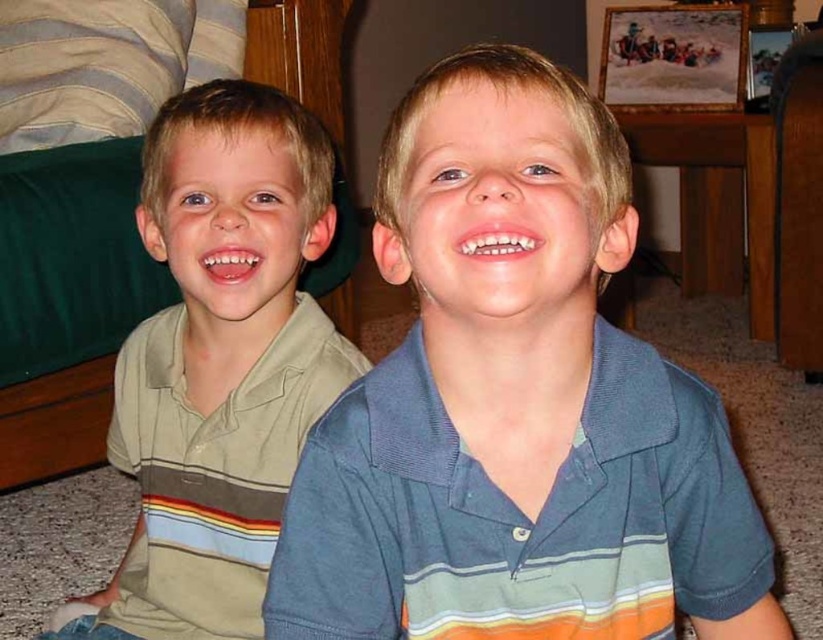
Question: Among these objects, which one is farthest from the camera?

Choices:
 (A) blue striped polo shirt at center
 (B) light brown striped polo shirt at left

Answer: (B)

Question: Is blue striped polo shirt at center wider than light brown striped polo shirt at left?

Choices:
 (A) yes
 (B) no

Answer: (A)

Question: Can you confirm if blue striped polo shirt at center is positioned to the right of light brown striped polo shirt at left?

Choices:
 (A) no
 (B) yes

Answer: (B)

Question: Does blue striped polo shirt at center appear on the right side of light brown striped polo shirt at left?

Choices:
 (A) yes
 (B) no

Answer: (A)